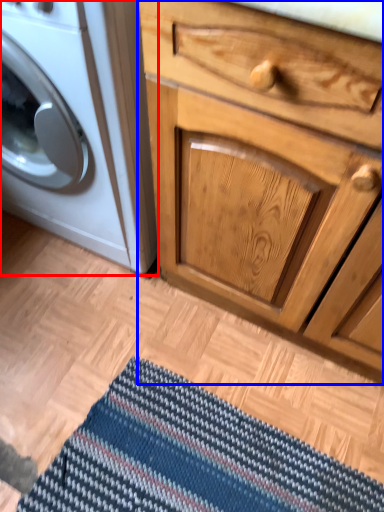
Question: Which object appears farthest to the camera in this image, washing machine (highlighted by a red box) or chest of drawers (highlighted by a blue box)?

Choices:
 (A) washing machine
 (B) chest of drawers

Answer: (A)